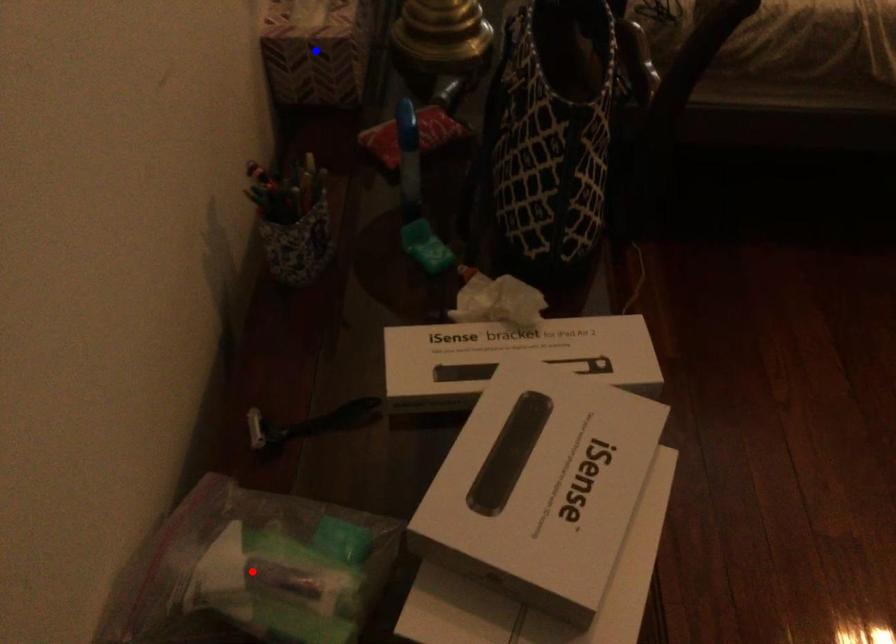
Question: Which of the two points in the image is closer to the camera?

Choices:
 (A) Blue point is closer.
 (B) Red point is closer.

Answer: (B)